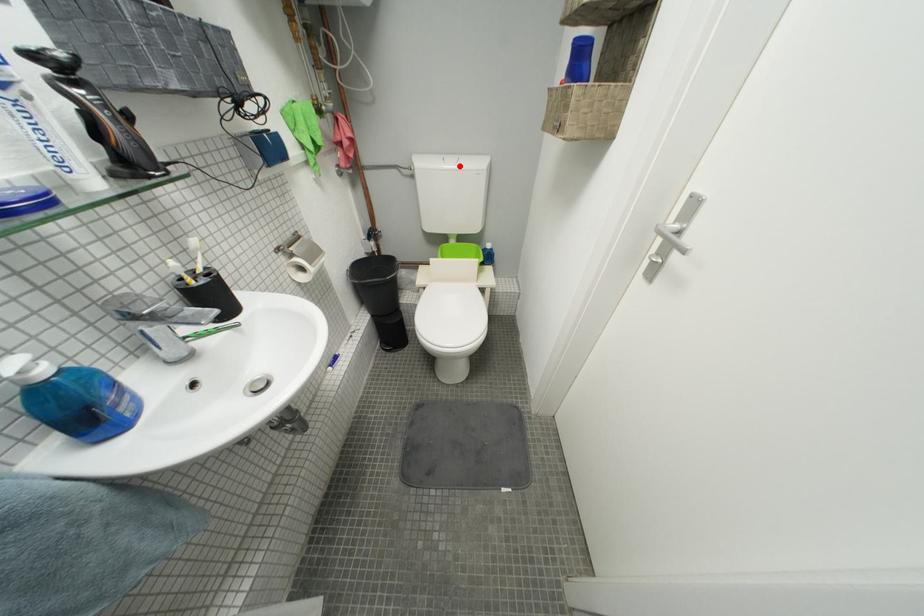
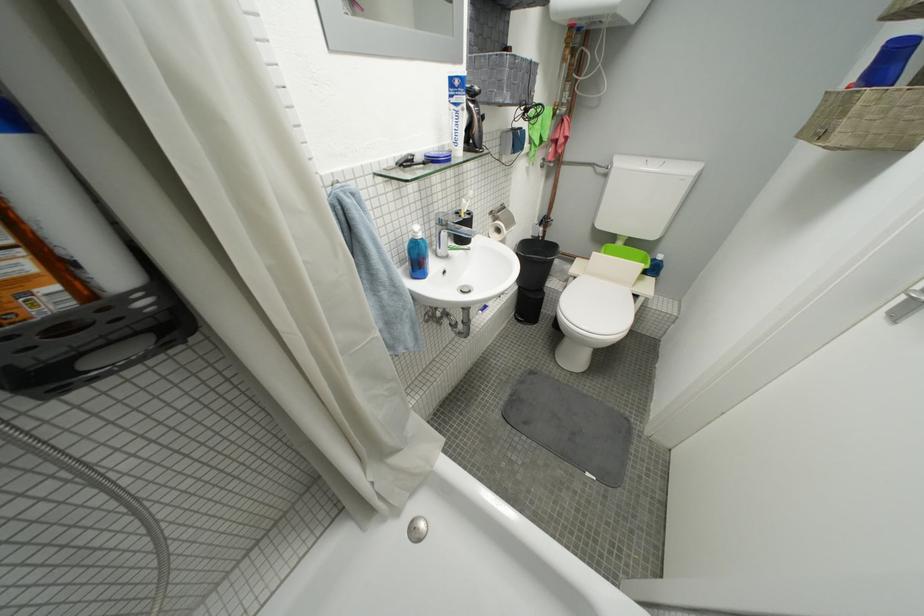
Question: A red point is marked in image1. In image2, is the corresponding 3D point closer to the camera or farther? Reply with the corresponding letter.

Choices:
 (A) The corresponding 3D point is closer.
 (B) The corresponding 3D point is farther.

Answer: (A)